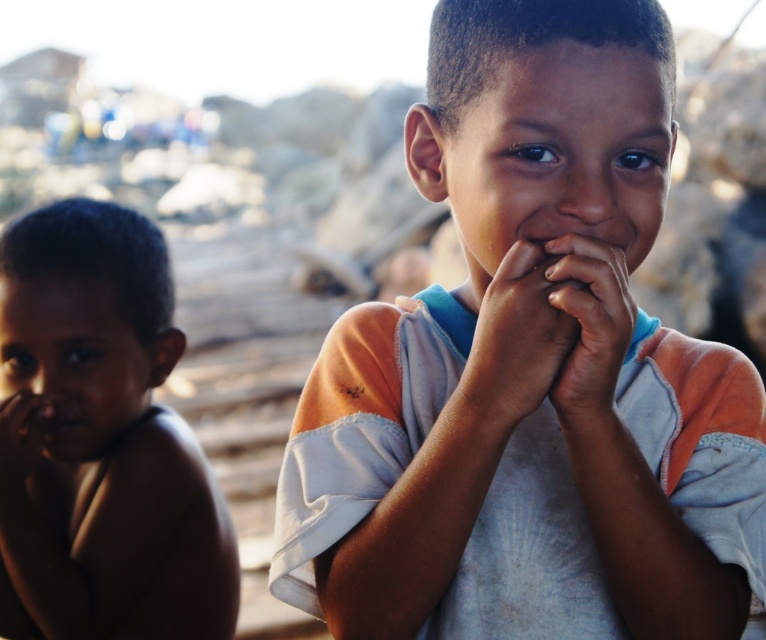
Question: Is smooth skin hands at center wider than smooth skin mouth at lower left?

Choices:
 (A) yes
 (B) no

Answer: (A)

Question: Is dark skin hand at center positioned behind smooth skin nose at center?

Choices:
 (A) no
 (B) yes

Answer: (A)

Question: Which object appears farthest from the camera in this image?

Choices:
 (A) smooth skin hands at center
 (B) smooth skin mouth at lower left
 (C) smooth skin nose at center
 (D) white cotton shirt at center

Answer: (B)

Question: Can you confirm if smooth skin hands at center is thinner than matte skin nose at left?

Choices:
 (A) no
 (B) yes

Answer: (B)

Question: Considering the real-world distances, which object is closest to the smooth skin child at left?

Choices:
 (A) smooth skin mouth at lower left
 (B) smooth skin nose at center
 (C) white cotton shirt at center

Answer: (A)

Question: Which object is closer to the camera taking this photo?

Choices:
 (A) white cotton shirt at center
 (B) dark skin hand at center
 (C) smooth skin hand at left
 (D) smooth skin mouth at lower left

Answer: (A)